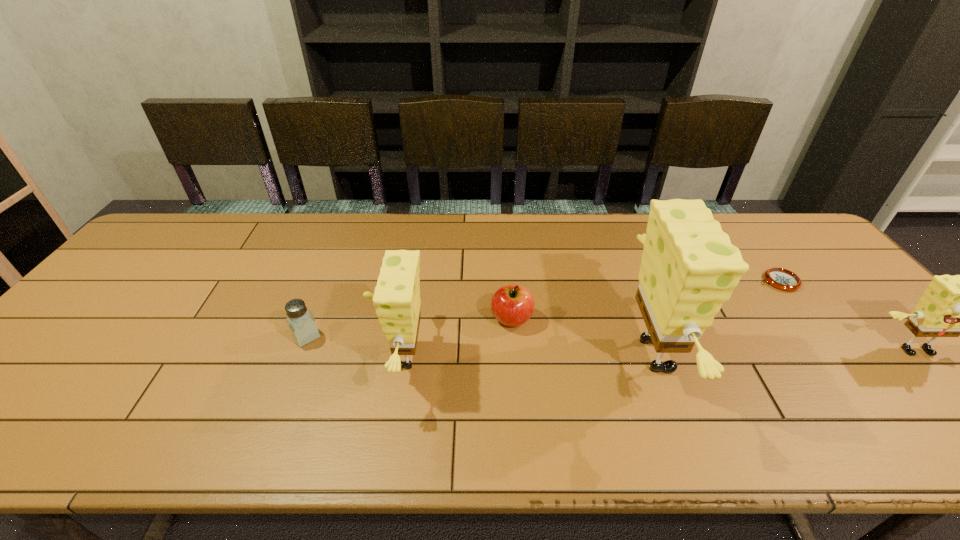
Identify the location of vacant space located 0.380m on the front-facing side of the second tallest object. point(220,356).

Where is `vacant space located on the front-facing side of the tallest sponge`? vacant space located on the front-facing side of the tallest sponge is located at coordinates (799, 355).

At what (x,y) coordinates should I click in order to perform the action: click on vacant space positioned on the front of the shortest object. Please return your answer as a coordinate pair (x, y). Looking at the image, I should click on (851, 375).

Locate an element on the screen. The height and width of the screenshot is (540, 960). vacant space located on the back of the apple is located at coordinates (509, 278).

This screenshot has width=960, height=540. What are the coordinates of `free space located 0.080m on the right of the leftmost object` in the screenshot? It's located at pyautogui.click(x=352, y=336).

The image size is (960, 540). I want to click on object at the right edge, so click(783, 279).

This screenshot has width=960, height=540. I want to click on vacant space at the far edge, so click(532, 216).

At what (x,y) coordinates should I click in order to perform the action: click on vacant region at the near edge. Please return your answer as a coordinate pair (x, y). The image size is (960, 540). Looking at the image, I should click on (412, 399).

In order to click on free space at the left edge of the desktop in this screenshot , I will do `click(30, 375)`.

Locate an element on the screen. The image size is (960, 540). vacant space at the right edge of the desktop is located at coordinates (887, 370).